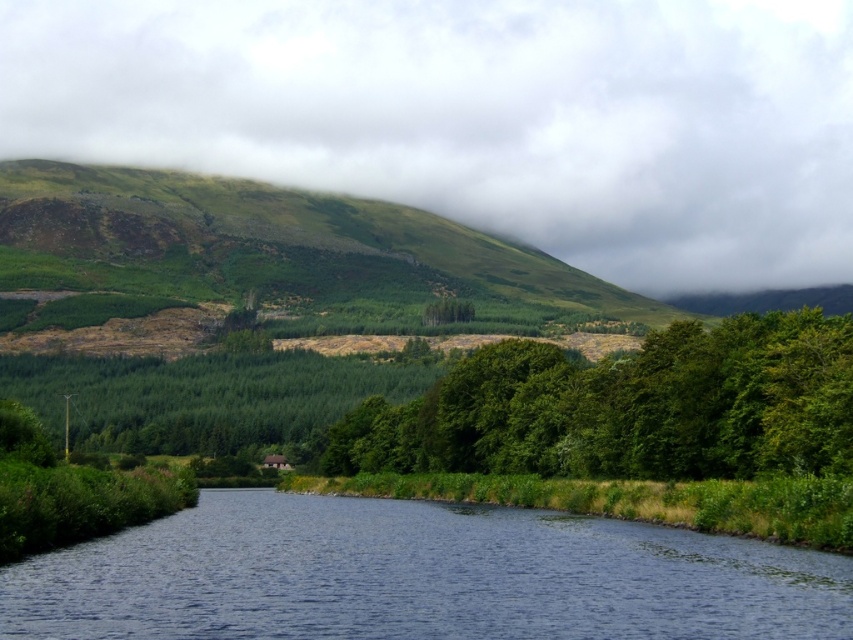
Question: Estimate the real-world distances between objects in this image. Which object is closer to the green grassy hillside at upper left?

Choices:
 (A) green matte hillside at upper center
 (B) green leafy trees at center

Answer: (A)

Question: In this image, where is green matte hillside at upper center located relative to green leafy trees at center?

Choices:
 (A) above
 (B) below

Answer: (A)

Question: Which point is closer to the camera taking this photo?

Choices:
 (A) (360, 179)
 (B) (183, 320)

Answer: (B)

Question: Is green matte hillside at upper center further to the viewer compared to green grassy hillside at upper left?

Choices:
 (A) yes
 (B) no

Answer: (A)

Question: Can you confirm if green matte hillside at upper center is bigger than green grassy hillside at upper left?

Choices:
 (A) no
 (B) yes

Answer: (B)

Question: Which of these objects is positioned farthest from the green leafy trees at center?

Choices:
 (A) green matte hillside at upper center
 (B) blue water at center
 (C) green grassy hillside at upper left

Answer: (A)